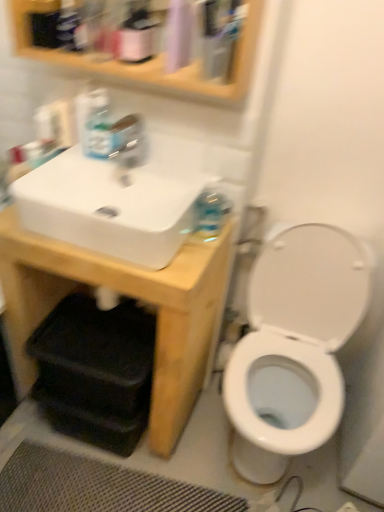
Question: Is matte pink spray bottle at upper center not near white glossy toilet at right?

Choices:
 (A) yes
 (B) no

Answer: (B)

Question: Is matte pink spray bottle at upper center positioned in front of white glossy toilet at right?

Choices:
 (A) no
 (B) yes

Answer: (A)

Question: Is matte pink spray bottle at upper center directly adjacent to white glossy toilet at right?

Choices:
 (A) yes
 (B) no

Answer: (B)

Question: Is matte pink spray bottle at upper center positioned with its back to white glossy toilet at right?

Choices:
 (A) yes
 (B) no

Answer: (B)

Question: Is matte pink spray bottle at upper center thinner than white glossy toilet at right?

Choices:
 (A) yes
 (B) no

Answer: (A)

Question: Is white glossy toilet at right inside or outside of transparent plastic tap at upper center?

Choices:
 (A) outside
 (B) inside

Answer: (A)

Question: From a real-world perspective, relative to transparent plastic tap at upper center, is white glossy toilet at right vertically above or below?

Choices:
 (A) below
 (B) above

Answer: (A)

Question: From the image's perspective, is white glossy toilet at right located above or below transparent plastic tap at upper center?

Choices:
 (A) below
 (B) above

Answer: (A)

Question: In terms of height, does white glossy toilet at right look taller or shorter compared to transparent plastic tap at upper center?

Choices:
 (A) short
 (B) tall

Answer: (B)

Question: From a real-world perspective, is translucent plastic soap dispenser at upper left positioned above or below clear plastic mouthwash at upper center?

Choices:
 (A) below
 (B) above

Answer: (A)

Question: Is translucent plastic soap dispenser at upper left situated inside clear plastic mouthwash at upper center or outside?

Choices:
 (A) outside
 (B) inside

Answer: (A)

Question: From the image's perspective, is translucent plastic soap dispenser at upper left located above or below clear plastic mouthwash at upper center?

Choices:
 (A) below
 (B) above

Answer: (A)

Question: Looking at the image, does translucent plastic soap dispenser at upper left seem bigger or smaller compared to clear plastic mouthwash at upper center?

Choices:
 (A) big
 (B) small

Answer: (B)

Question: Considering the positions of point (160, 162) and point (228, 25), is point (160, 162) closer or farther from the camera than point (228, 25)?

Choices:
 (A) closer
 (B) farther

Answer: (B)

Question: From the image's perspective, relative to clear plastic mouthwash at upper center, is white glossy sink at upper left above or below?

Choices:
 (A) above
 (B) below

Answer: (B)